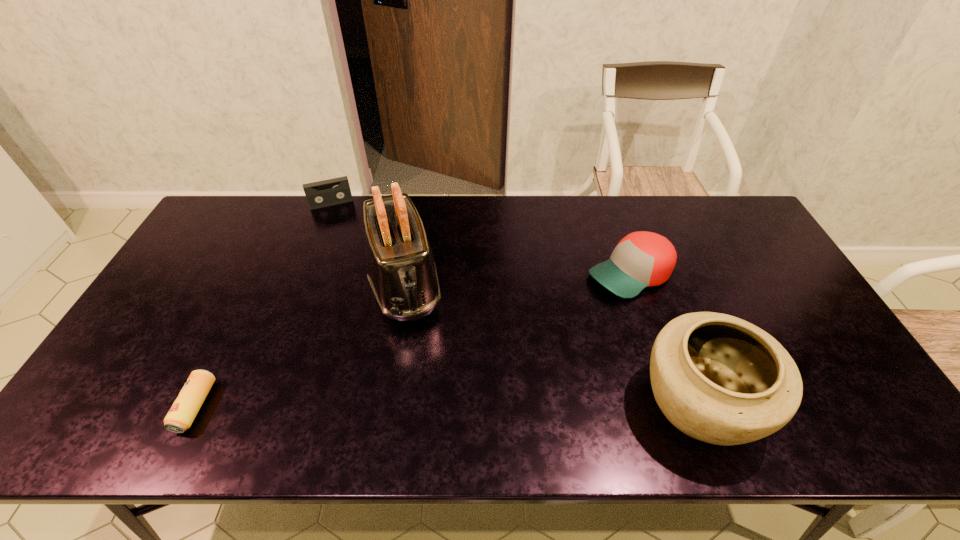
You are a GUI agent. You are given a task and a screenshot of the screen. Output one action in this format:
    pyautogui.click(x=<x>, y=<y>)
    Task: Click on the free space that is in between the beer can and the pottery
    The width and height of the screenshot is (960, 540).
    Given the screenshot: What is the action you would take?
    pyautogui.click(x=447, y=404)

Where is `unoccupied area between the fourth object from right to left and the pottery`? unoccupied area between the fourth object from right to left and the pottery is located at coordinates (516, 303).

Locate an element on the screen. The width and height of the screenshot is (960, 540). free spot between the videotape and the fourth shortest object is located at coordinates (516, 303).

Locate an element on the screen. The image size is (960, 540). empty space between the farthest object and the shortest object is located at coordinates (264, 305).

At what (x,y) coordinates should I click in order to perform the action: click on vacant area that lies between the toaster and the beer can. Please return your answer as a coordinate pair (x, y). This screenshot has width=960, height=540. Looking at the image, I should click on (300, 345).

Locate an element on the screen. Image resolution: width=960 pixels, height=540 pixels. object that can be found as the second closest to the fourth shortest object is located at coordinates (401, 270).

Where is `the second closest object to the shortest object`? The image size is (960, 540). the second closest object to the shortest object is located at coordinates (319, 194).

You are a GUI agent. You are given a task and a screenshot of the screen. Output one action in this format:
    pyautogui.click(x=<x>, y=<y>)
    Task: Click on the vacant area that satisfies the following two spatial constraints: 1. on the front side of the second shortest object; 2. on the right side of the third shortest object
    
    Given the screenshot: What is the action you would take?
    pyautogui.click(x=304, y=274)

Locate an element on the screen. This screenshot has width=960, height=540. free space that satisfies the following two spatial constraints: 1. on the front side of the third tallest object; 2. on the right side of the second object from left to right is located at coordinates (304, 274).

Locate an element on the screen. The image size is (960, 540). free space that satisfies the following two spatial constraints: 1. on the back side of the third object from right to left; 2. on the left side of the baseball cap is located at coordinates (406, 274).